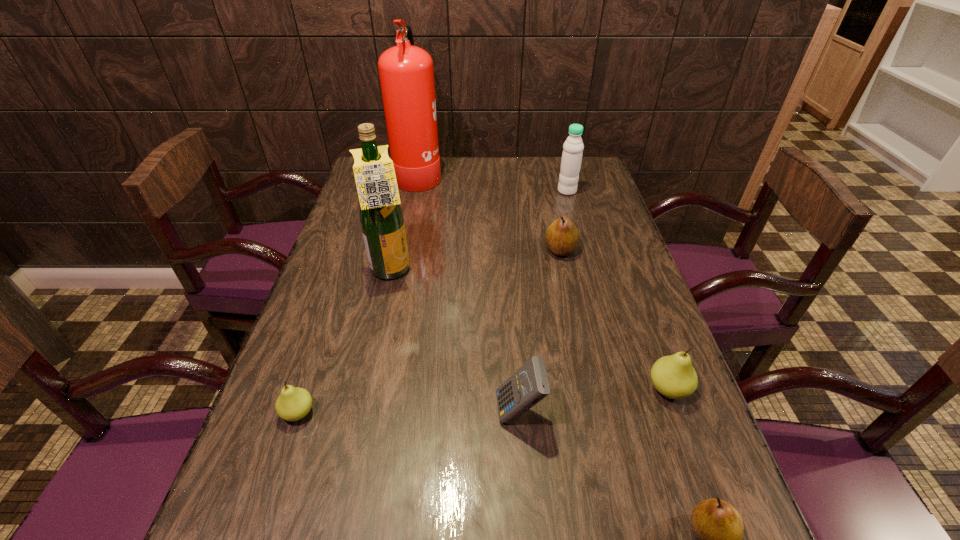
Locate an element on the screen. Image resolution: width=960 pixels, height=540 pixels. the tallest object is located at coordinates (406, 73).

You are a GUI agent. You are given a task and a screenshot of the screen. Output one action in this format:
    pyautogui.click(x=<x>, y=<y>)
    Task: Click on the red fire extinguisher
    This screenshot has height=540, width=960.
    Given the screenshot: What is the action you would take?
    pyautogui.click(x=406, y=73)

Where is `liquor`? liquor is located at coordinates (381, 216).

In order to click on the sixth shortest object in this screenshot , I will do `click(573, 147)`.

This screenshot has width=960, height=540. In order to click on white water bottle in this screenshot , I will do `click(573, 147)`.

Identify the location of calculator. (529, 384).

Identify the location of the fourth object from left to right. The height and width of the screenshot is (540, 960). (529, 384).

Identify the location of the bigger brown pear. (562, 237).

This screenshot has width=960, height=540. Find the location of `the left brown pear`. the left brown pear is located at coordinates (562, 237).

Where is `the bigger green pear`? The width and height of the screenshot is (960, 540). the bigger green pear is located at coordinates (673, 376).